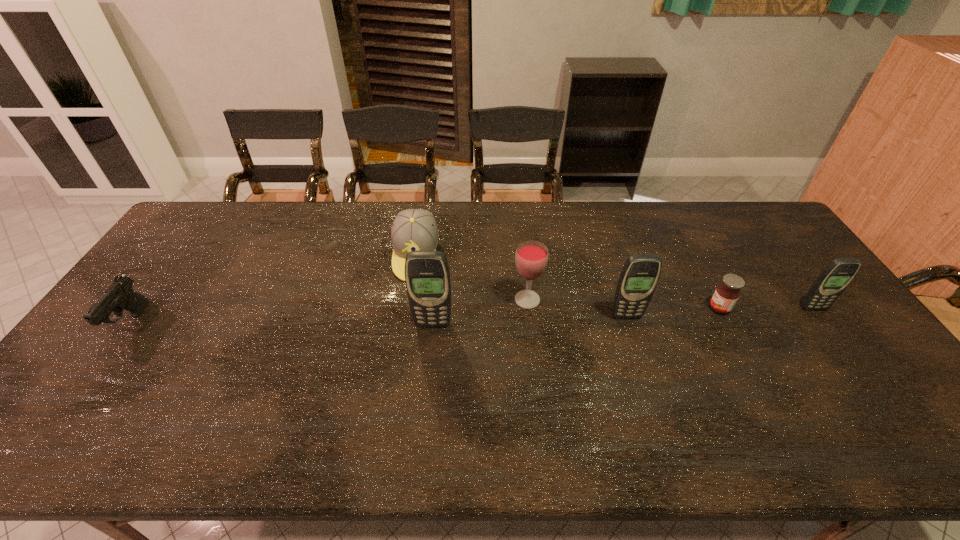
Identify the location of the leftmost cellular telephone. (427, 276).

Identify the location of the second farthest cellular telephone. (640, 274).

I want to click on the third object from right to left, so click(x=640, y=274).

Where is `the rightmost cellular telephone`? Image resolution: width=960 pixels, height=540 pixels. the rightmost cellular telephone is located at coordinates (838, 274).

Where is `the shortest cellular telephone`? The image size is (960, 540). the shortest cellular telephone is located at coordinates (838, 274).

The height and width of the screenshot is (540, 960). Find the location of `the fourth object from right to left`. the fourth object from right to left is located at coordinates (531, 258).

You are a GUI agent. You are given a task and a screenshot of the screen. Output one action in this format:
    pyautogui.click(x=<x>, y=<y>)
    Task: Click on the baseball cap
    
    Given the screenshot: What is the action you would take?
    pyautogui.click(x=413, y=229)

Identify the location of pistol. The width and height of the screenshot is (960, 540). (119, 295).

Find the location of `jam`. jam is located at coordinates (726, 294).

Locate an element on the screen. The height and width of the screenshot is (540, 960). free spot located 0.200m on the screen of the leftmost cellular telephone is located at coordinates (426, 392).